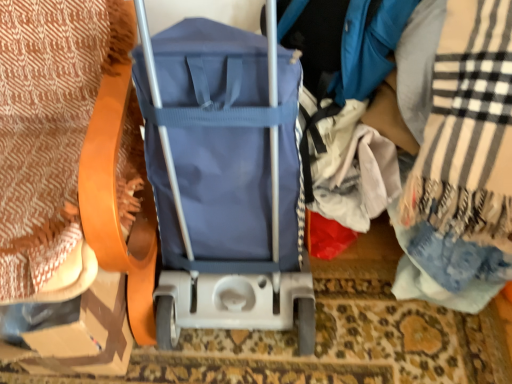
Question: Does cardboard at left turn towards patterned fabric blanket at left, the second blanket when ordered from right to left?

Choices:
 (A) yes
 (B) no

Answer: (A)

Question: Would you say patterned fabric blanket at left, the second blanket when ordered from right to left, is part of cardboard at left's contents?

Choices:
 (A) yes
 (B) no

Answer: (B)

Question: Considering the relative sizes of cardboard at left and patterned fabric blanket at left, arranged as the first blanket when viewed from the left, in the image provided, is cardboard at left wider than patterned fabric blanket at left, arranged as the first blanket when viewed from the left,?

Choices:
 (A) no
 (B) yes

Answer: (A)

Question: Is cardboard at left at the left side of patterned fabric blanket at left, the second blanket when ordered from right to left?

Choices:
 (A) yes
 (B) no

Answer: (B)

Question: Does cardboard at left lie in front of patterned fabric blanket at left, arranged as the first blanket when viewed from the left?

Choices:
 (A) no
 (B) yes

Answer: (A)

Question: From a real-world perspective, is patterned fabric blanket at left, arranged as the first blanket when viewed from the left, above or below cardboard at left?

Choices:
 (A) below
 (B) above

Answer: (B)

Question: In the image, is patterned fabric blanket at left, arranged as the first blanket when viewed from the left, on the left side or the right side of cardboard at left?

Choices:
 (A) left
 (B) right

Answer: (A)

Question: Considering the positions of patterned fabric blanket at left, arranged as the first blanket when viewed from the left, and cardboard at left in the image, is patterned fabric blanket at left, arranged as the first blanket when viewed from the left, bigger or smaller than cardboard at left?

Choices:
 (A) big
 (B) small

Answer: (A)

Question: Is patterned fabric blanket at left, arranged as the first blanket when viewed from the left, situated inside cardboard at left or outside?

Choices:
 (A) outside
 (B) inside

Answer: (A)

Question: Looking at their shapes, would you say plaid woolen blanket at right, the second blanket positioned from the left, is wider or thinner than cardboard at left?

Choices:
 (A) wide
 (B) thin

Answer: (A)

Question: From a real-world perspective, is plaid woolen blanket at right, the second blanket positioned from the left, above or below cardboard at left?

Choices:
 (A) below
 (B) above

Answer: (B)

Question: Considering the positions of plaid woolen blanket at right, the second blanket positioned from the left, and cardboard at left in the image, is plaid woolen blanket at right, the second blanket positioned from the left, taller or shorter than cardboard at left?

Choices:
 (A) short
 (B) tall

Answer: (B)

Question: Is point (493, 226) positioned closer to the camera than point (64, 365)?

Choices:
 (A) farther
 (B) closer

Answer: (B)

Question: From the image's perspective, is cardboard at left above or below patterned fabric blanket at left, arranged as the first blanket when viewed from the left?

Choices:
 (A) below
 (B) above

Answer: (A)

Question: Does point (96, 289) appear closer or farther from the camera than point (123, 24)?

Choices:
 (A) farther
 (B) closer

Answer: (B)